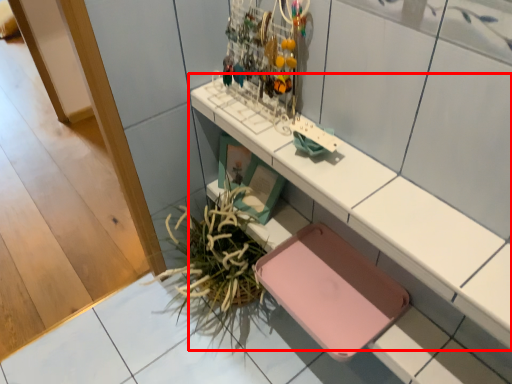
Question: From the image's perspective, what is the correct spatial positioning of shelf (annotated by the red box) in reference to plant?

Choices:
 (A) above
 (B) below

Answer: (A)